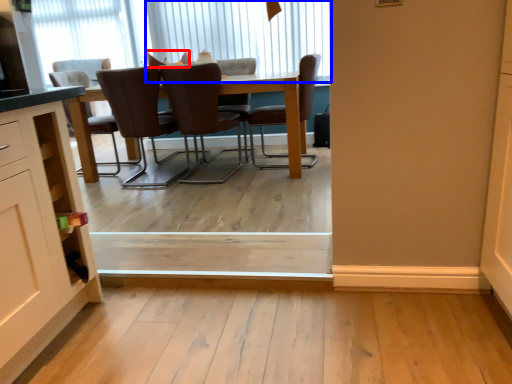
Question: Which object appears farthest to the camera in this image, chair (highlighted by a red box) or window (highlighted by a blue box)?

Choices:
 (A) chair
 (B) window

Answer: (B)